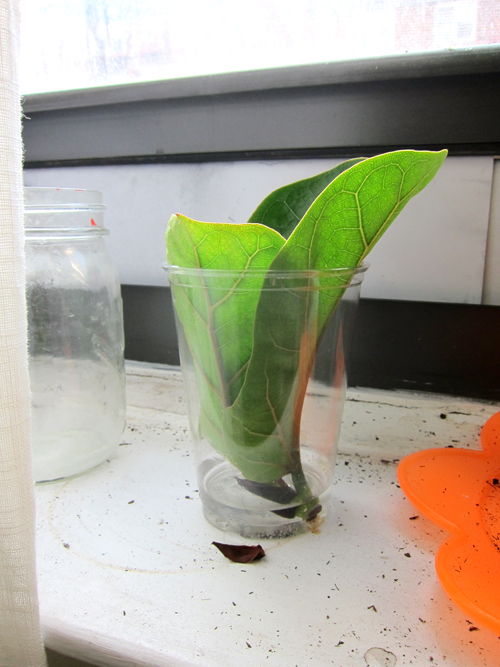
You are a GUI agent. You are given a task and a screenshot of the screen. Output one action in this format:
    pyautogui.click(x=<x>, y=<y>)
    Task: Click on the plant
    The image size is (500, 667).
    Given the screenshot: What is the action you would take?
    pyautogui.click(x=311, y=225)